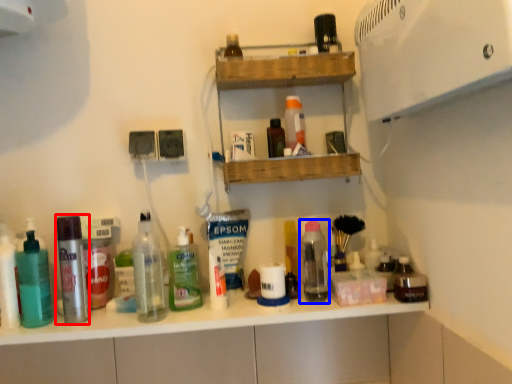
Question: Which object appears farthest to the camera in this image, bottle (highlighted by a red box) or bottle (highlighted by a blue box)?

Choices:
 (A) bottle
 (B) bottle

Answer: (B)